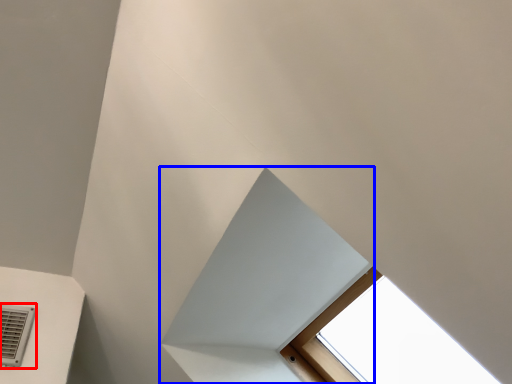
Question: Among these objects, which one is nearest to the camera, air conditioning (highlighted by a red box) or exhaust hood (highlighted by a blue box)?

Choices:
 (A) air conditioning
 (B) exhaust hood

Answer: (B)